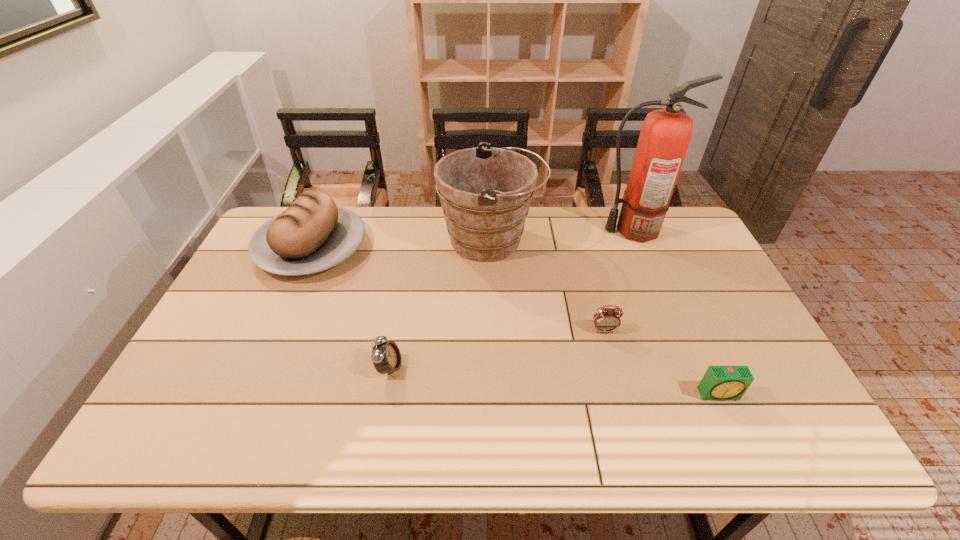
You are a GUI agent. You are given a task and a screenshot of the screen. Output one action in this format:
    pyautogui.click(x=<x>, y=<y>)
    Task: Click on the blank region between the fire extinguisher and the farthest alarm clock
    This screenshot has width=960, height=540.
    Given the screenshot: What is the action you would take?
    pyautogui.click(x=618, y=280)

Locate which object ranks fifth in proximity to the bucket. Please provide its 2D coordinates. Your answer should be formatted as a tuple, i.e. [(x, y)], where the tuple contains the x and y coordinates of a point satisfying the conditions above.

[(720, 383)]

You are a GUI agent. You are given a task and a screenshot of the screen. Output one action in this format:
    pyautogui.click(x=<x>, y=<y>)
    Task: Click on the object identified as the fifth closest to the nearest alarm clock
    The width and height of the screenshot is (960, 540).
    Given the screenshot: What is the action you would take?
    pyautogui.click(x=313, y=234)

Point out which alarm clock is positioned as the nearest to the rightmost alarm clock. Please provide its 2D coordinates. Your answer should be formatted as a tuple, i.e. [(x, y)], where the tuple contains the x and y coordinates of a point satisfying the conditions above.

[(605, 320)]

Identify the location of alarm clock object that ranks as the third closest to the tallest object. The image size is (960, 540). (386, 356).